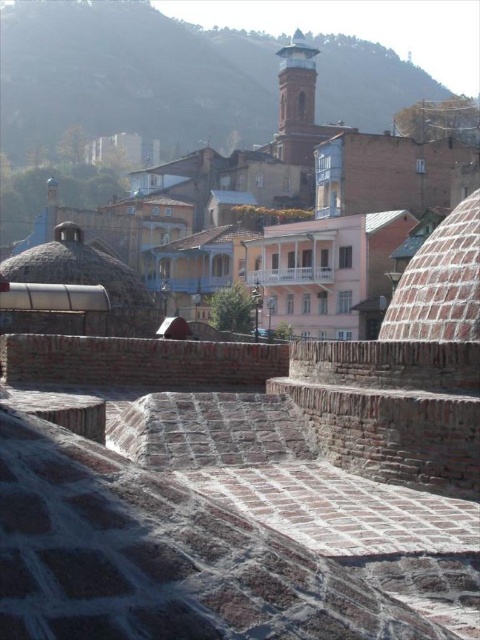
Question: Observing the image, what is the correct spatial positioning of brown brick town at center in reference to smooth brick tower at upper center?

Choices:
 (A) left
 (B) right

Answer: (A)

Question: In this image, where is brown brick town at center located relative to smooth brick tower at upper center?

Choices:
 (A) right
 (B) left

Answer: (B)

Question: Does brown brick town at center appear under smooth brick tower at upper center?

Choices:
 (A) no
 (B) yes

Answer: (B)

Question: Which point is farther from the camera taking this photo?

Choices:
 (A) (288, 51)
 (B) (414, 140)

Answer: (A)